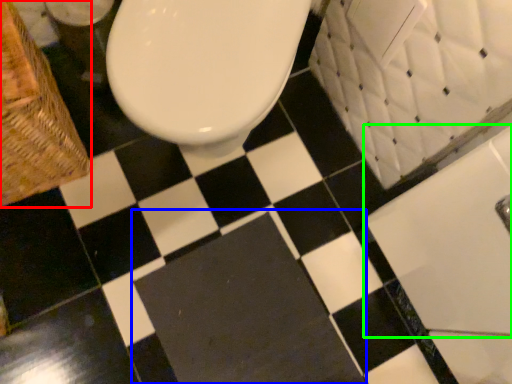
Question: Which object is the closest to the basket (highlighted by a red box)? Choose among these: bath mat (highlighted by a blue box) or bath (highlighted by a green box).

Choices:
 (A) bath mat
 (B) bath

Answer: (A)